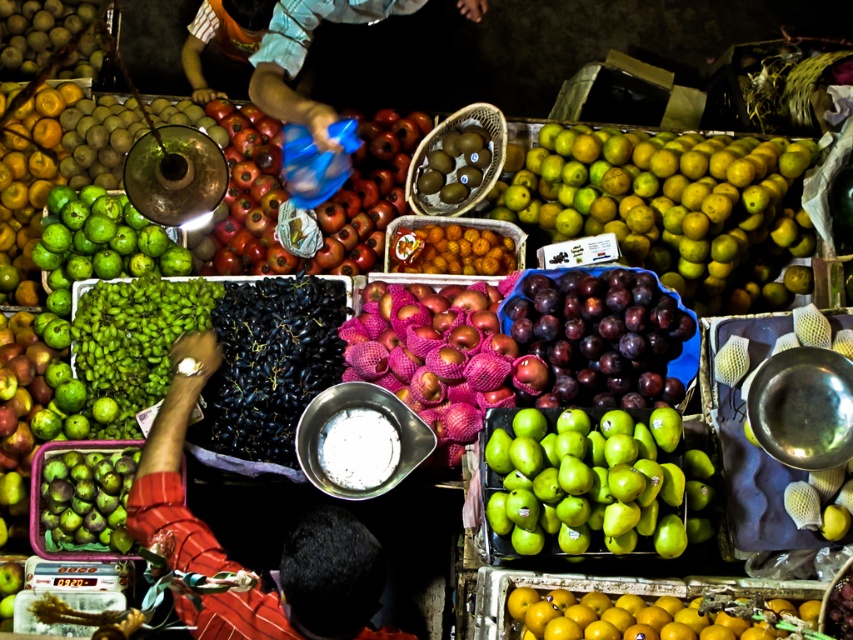
You are standing at a fruit market and want to pick up an orange from the crate located at point (368, 292). If you are currently 13.41 feet away from this point, can you reach it without moving closer?

The point (368, 292) is 13.41 feet away from you, so you cannot reach the orange without moving closer since that distance is too far to reach comfortably.

You are a vendor at the fruit market and need to pack a box that can fit either the shiny red pomegranate at center or the pink mesh bagged apples at center. Which fruit requires a larger box based on their widths?

The shiny red pomegranate at center requires a larger box because its width is greater than that of the pink mesh bagged apples at center.

You are a vendor at the fruit market and want to place a new fruit basket between the green matte pears at center and the shiny red pomegranate at center. If the basket requires 1.2 meters of space, can it fit between them?

The space between the green matte pears at center and the shiny red pomegranate at center is not specified in the provided information. The description only mentions their widths, not the distance between them. Therefore, it is impossible to determine if the basket will fit based on the given details.